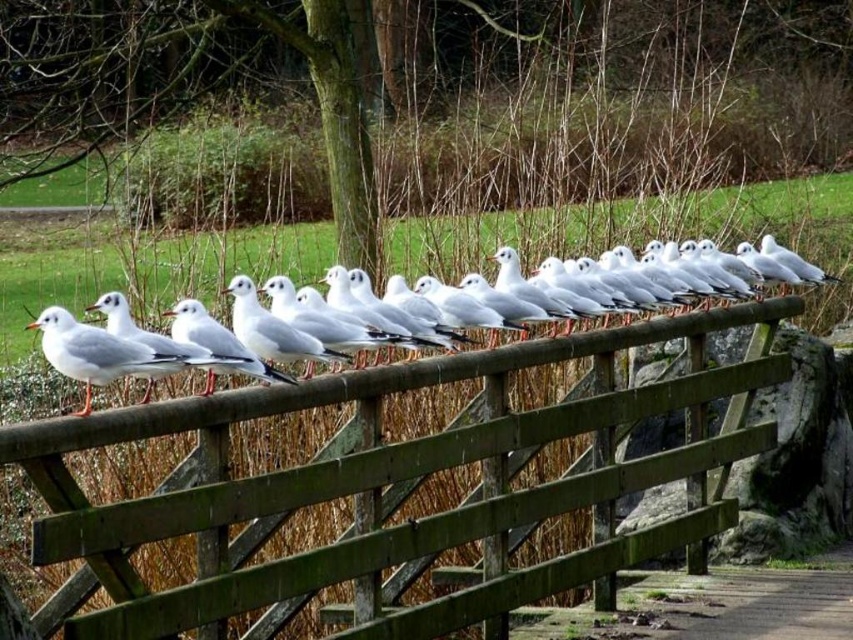
The image size is (853, 640). I want to click on wooden fence at center, so click(x=399, y=483).

Which is more to the right, wooden fence at center or white matte seagull at center?

wooden fence at center is more to the right.

Is point (439, 440) less distant than point (572, 365)?

Yes, it is in front of point (572, 365).

This screenshot has width=853, height=640. Find the location of `wooden fence at center`. wooden fence at center is located at coordinates (399, 483).

Which is in front, point (672, 337) or point (73, 324)?

Point (73, 324) is in front.

Is wooden fence at center positioned in front of white matte seagull at left?

Yes, wooden fence at center is in front of white matte seagull at left.

Between point (224, 492) and point (64, 365), which one is positioned behind?

Positioned behind is point (224, 492).

The height and width of the screenshot is (640, 853). In order to click on wooden fence at center in this screenshot , I will do `click(399, 483)`.

Can you confirm if white matte seagull at center is bigger than white matte seagull at left?

Yes, white matte seagull at center is bigger than white matte seagull at left.

Between white matte seagull at center and white matte seagull at left, which one appears on the left side from the viewer's perspective?

white matte seagull at left

Between point (109, 257) and point (178, 360), which one is positioned in front?

Point (178, 360) is in front.

Locate an element on the screen. white matte seagull at center is located at coordinates (50, 284).